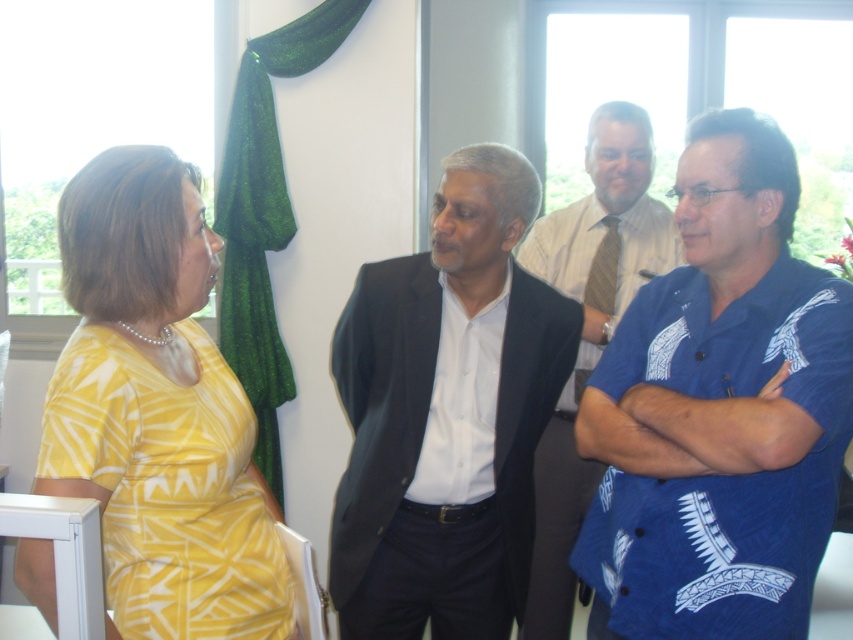
Question: Can you confirm if blue printed shirt at center is smaller than white shirt at center?

Choices:
 (A) yes
 (B) no

Answer: (A)

Question: Which object is closer to the camera taking this photo?

Choices:
 (A) yellow printed dress at left
 (B) blue printed shirt at center
 (C) white shirt at center

Answer: (A)

Question: Which of the following is the closest to the observer?

Choices:
 (A) blue printed shirt at center
 (B) yellow printed dress at left
 (C) dark gray suit at center
 (D) white shirt at center

Answer: (B)

Question: Is the position of dark gray suit at center less distant than that of white shirt at center?

Choices:
 (A) yes
 (B) no

Answer: (A)

Question: Is blue printed shirt at center closer to the viewer compared to dark gray suit at center?

Choices:
 (A) yes
 (B) no

Answer: (A)

Question: Which point is farther from the camera taking this photo?

Choices:
 (A) (697, 376)
 (B) (154, 561)

Answer: (A)